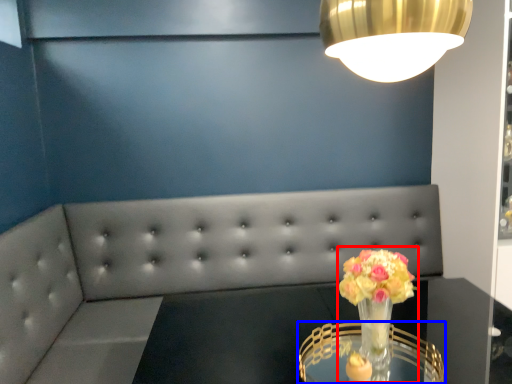
Question: Which point is further to the camera, floral arrangement (highlighted by a red box) or table (highlighted by a blue box)?

Choices:
 (A) floral arrangement
 (B) table

Answer: (A)